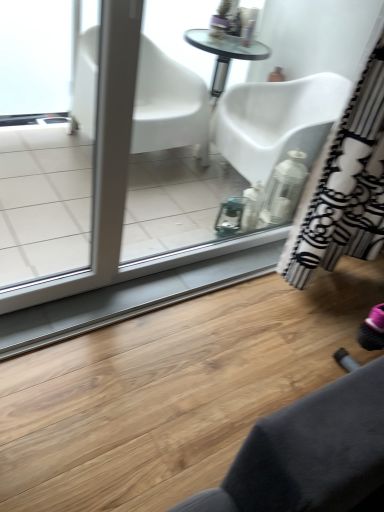
The width and height of the screenshot is (384, 512). In order to click on black and white striped curtain at right in this screenshot , I will do `click(344, 185)`.

The width and height of the screenshot is (384, 512). Describe the element at coordinates (344, 185) in the screenshot. I see `black and white striped curtain at right` at that location.

Locate an element on the screen. This screenshot has height=512, width=384. white glossy screen door at left is located at coordinates (49, 183).

This screenshot has height=512, width=384. Describe the element at coordinates (49, 183) in the screenshot. I see `white glossy screen door at left` at that location.

Find the location of a particular element. This screenshot has height=512, width=384. black and white striped curtain at right is located at coordinates point(344,185).

Which object is positioned more to the right, white glossy screen door at left or black and white striped curtain at right?

black and white striped curtain at right.

Does white glossy screen door at left lie behind black and white striped curtain at right?

No, the depth of white glossy screen door at left is less than that of black and white striped curtain at right.

Considering the points (93, 55) and (308, 245), which point is behind, point (93, 55) or point (308, 245)?

Positioned behind is point (93, 55).

From the image's perspective, relative to black and white striped curtain at right, is white glossy screen door at left above or below?

white glossy screen door at left is below black and white striped curtain at right.

From a real-world perspective, is white glossy screen door at left physically above black and white striped curtain at right?

No, from a real-world perspective, white glossy screen door at left is not above black and white striped curtain at right.

Is white glossy screen door at left wider or thinner than black and white striped curtain at right?

white glossy screen door at left is thinner than black and white striped curtain at right.

Can you confirm if white glossy screen door at left is taller than black and white striped curtain at right?

Yes, white glossy screen door at left is taller than black and white striped curtain at right.

In the scene shown: Is white glossy screen door at left smaller than black and white striped curtain at right?

Yes, white glossy screen door at left is smaller than black and white striped curtain at right.

Does white glossy screen door at left contain black and white striped curtain at right?

No, black and white striped curtain at right is not inside white glossy screen door at left.

Is white glossy screen door at left positioned far away from black and white striped curtain at right?

Indeed, white glossy screen door at left is not near black and white striped curtain at right.

Is white glossy screen door at left positioned with its back to black and white striped curtain at right?

No, white glossy screen door at left is not facing away from black and white striped curtain at right.

How different are the orientations of white glossy screen door at left and black and white striped curtain at right in degrees?

The angular difference between white glossy screen door at left and black and white striped curtain at right is 0.000278 degrees.

How far apart are white glossy screen door at left and black and white striped curtain at right?

white glossy screen door at left and black and white striped curtain at right are 1.21 meters apart from each other.

Find the location of a particular element. screen door below the black and white striped curtain at right (from the image's perspective) is located at coordinates (49, 183).

Considering the relative positions of black and white striped curtain at right and white glossy screen door at left in the image provided, is black and white striped curtain at right to the left or to the right of white glossy screen door at left?

From the image, it's evident that black and white striped curtain at right is to the right of white glossy screen door at left.

Considering the positions of objects black and white striped curtain at right and white glossy screen door at left in the image provided, who is in front, black and white striped curtain at right or white glossy screen door at left?

white glossy screen door at left is closer to the camera.

Considering the positions of points (332, 238) and (97, 54), is point (332, 238) closer to camera compared to point (97, 54)?

No, (332, 238) is behind (97, 54).

From the image's perspective, which one is positioned lower, black and white striped curtain at right or white glossy screen door at left?

white glossy screen door at left, from the image's perspective.

From a real-world perspective, is black and white striped curtain at right physically above white glossy screen door at left?

Yes, from a real-world perspective, black and white striped curtain at right is over white glossy screen door at left

Considering the relative sizes of black and white striped curtain at right and white glossy screen door at left in the image provided, is black and white striped curtain at right thinner than white glossy screen door at left?

No.

Is black and white striped curtain at right shorter than white glossy screen door at left?

Correct, black and white striped curtain at right is not as tall as white glossy screen door at left.

Considering the relative sizes of black and white striped curtain at right and white glossy screen door at left in the image provided, is black and white striped curtain at right bigger than white glossy screen door at left?

Indeed, black and white striped curtain at right has a larger size compared to white glossy screen door at left.

Is black and white striped curtain at right situated inside white glossy screen door at left or outside?

black and white striped curtain at right is outside white glossy screen door at left.

Is black and white striped curtain at right beside white glossy screen door at left?

There is a gap between black and white striped curtain at right and white glossy screen door at left.

Could you tell me if black and white striped curtain at right is facing white glossy screen door at left?

No, black and white striped curtain at right is not turned towards white glossy screen door at left.

You are a GUI agent. You are given a task and a screenshot of the screen. Output one action in this format:
    pyautogui.click(x=<x>, y=<y>)
    Task: Click on the curtain located behind the white glossy screen door at left
    
    Given the screenshot: What is the action you would take?
    pyautogui.click(x=344, y=185)

Image resolution: width=384 pixels, height=512 pixels. Find the location of `curtain behind the white glossy screen door at left`. curtain behind the white glossy screen door at left is located at coordinates (344, 185).

You are a GUI agent. You are given a task and a screenshot of the screen. Output one action in this format:
    pyautogui.click(x=<x>, y=<y>)
    Task: Click on the curtain located on the right of white glossy screen door at left
    
    Given the screenshot: What is the action you would take?
    pyautogui.click(x=344, y=185)